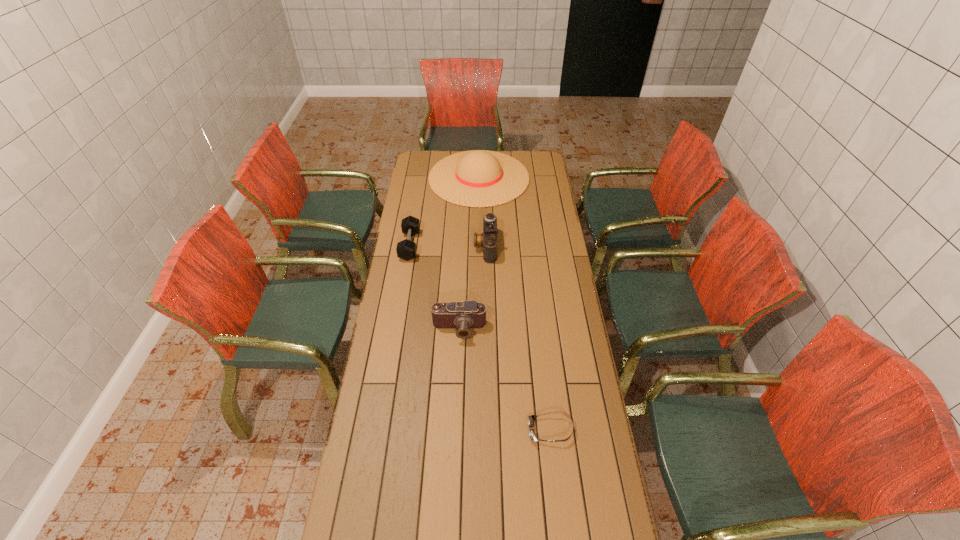
You are a GUI agent. You are given a task and a screenshot of the screen. Output one action in this format:
    pyautogui.click(x=<x>, y=<y>)
    Task: Click on the farthest object
    Image resolution: width=960 pixels, height=540 pixels.
    Given the screenshot: What is the action you would take?
    pyautogui.click(x=477, y=178)

I want to click on bonnet, so click(477, 178).

Where is `the farther camera`? Image resolution: width=960 pixels, height=540 pixels. the farther camera is located at coordinates (488, 239).

Find the location of `the nearer camera`. the nearer camera is located at coordinates (466, 315).

At what (x,y) coordinates should I click in order to perform the action: click on the fourth tallest object. Please return your answer as a coordinate pair (x, y). The height and width of the screenshot is (540, 960). Looking at the image, I should click on (406, 249).

Locate an element on the screen. dumbbell is located at coordinates (406, 249).

Image resolution: width=960 pixels, height=540 pixels. I want to click on the nearest object, so click(x=531, y=419).

Locate an element on the screen. This screenshot has height=540, width=960. the shortest object is located at coordinates (531, 419).

You are a GUI agent. You are given a task and a screenshot of the screen. Output one action in this format:
    pyautogui.click(x=<x>, y=<y>)
    Task: Click on the free space located on the front of the bonnet
    The width and height of the screenshot is (960, 540).
    Given the screenshot: What is the action you would take?
    pyautogui.click(x=479, y=256)

Identify the location of vacant point located 0.200m on the lens of the farther camera. (431, 246).